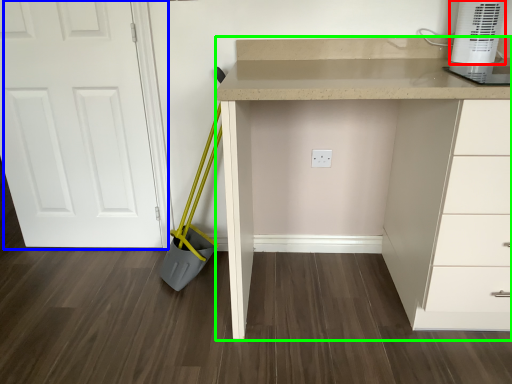
Question: Which object is the closest to the home appliance (highlighted by a red box)? Choose among these: door (highlighted by a blue box) or computer desk (highlighted by a green box).

Choices:
 (A) door
 (B) computer desk

Answer: (B)